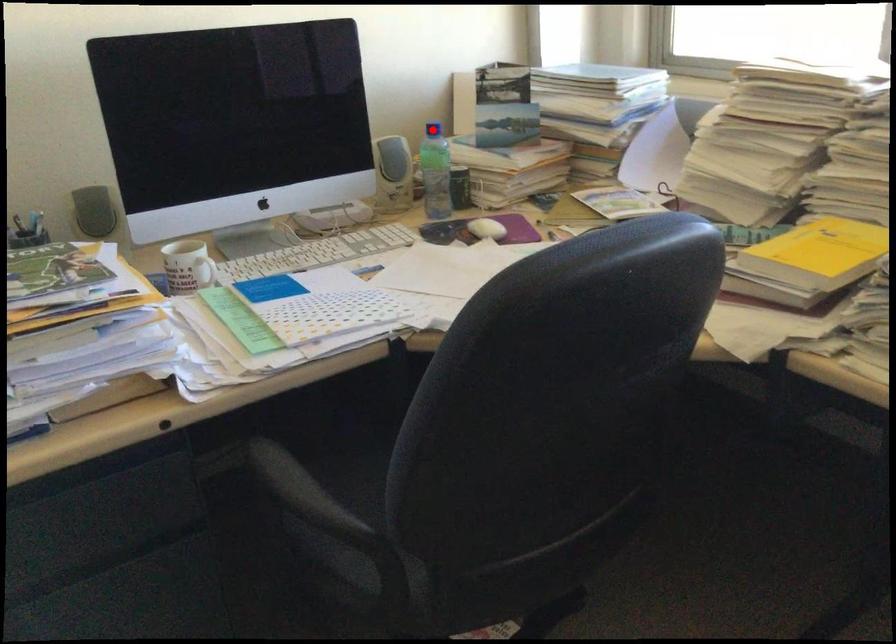
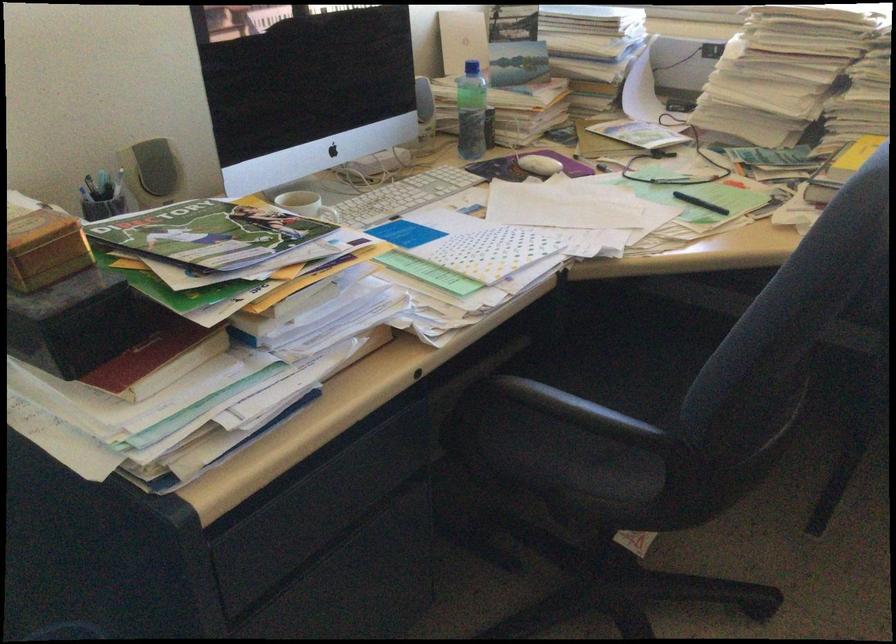
Question: A red point is marked in image1. In image2, is the corresponding 3D point closer to the camera or farther? Reply with the corresponding letter.

Choices:
 (A) The corresponding 3D point is closer.
 (B) The corresponding 3D point is farther.

Answer: (B)